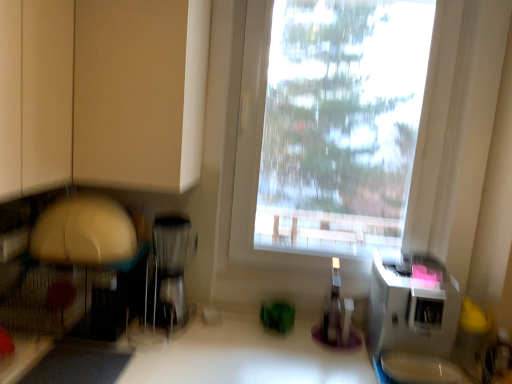
Find the location of a particular element. The height and width of the screenshot is (384, 512). free space in front of transparent plastic bottle at center is located at coordinates (340, 351).